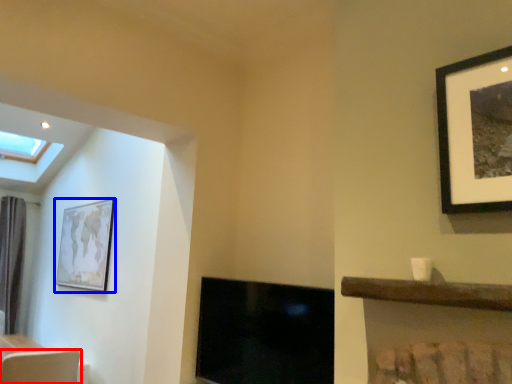
Question: Which of the following is the closest to the observer, swivel chair (highlighted by a red box) or picture frame (highlighted by a blue box)?

Choices:
 (A) swivel chair
 (B) picture frame

Answer: (A)